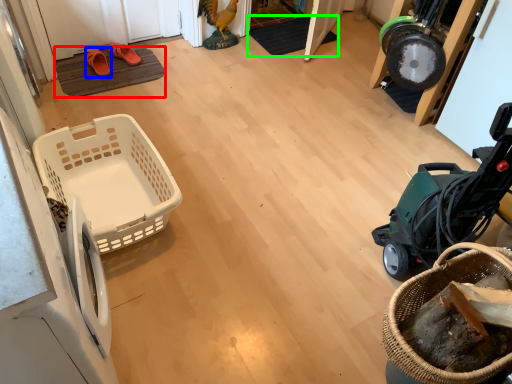
Question: Which is nearer to the doormat (highlighted by a red box)? footwear (highlighted by a blue box) or doormat (highlighted by a green box).

Choices:
 (A) footwear
 (B) doormat

Answer: (A)